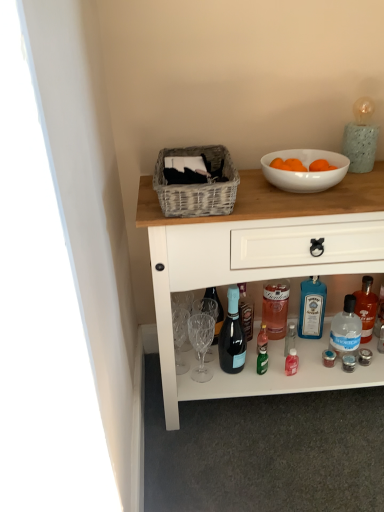
Find the location of a particular element. This screenshot has height=512, width=384. vacant area that lies to the right of woven gray picnic basket at upper center is located at coordinates (273, 195).